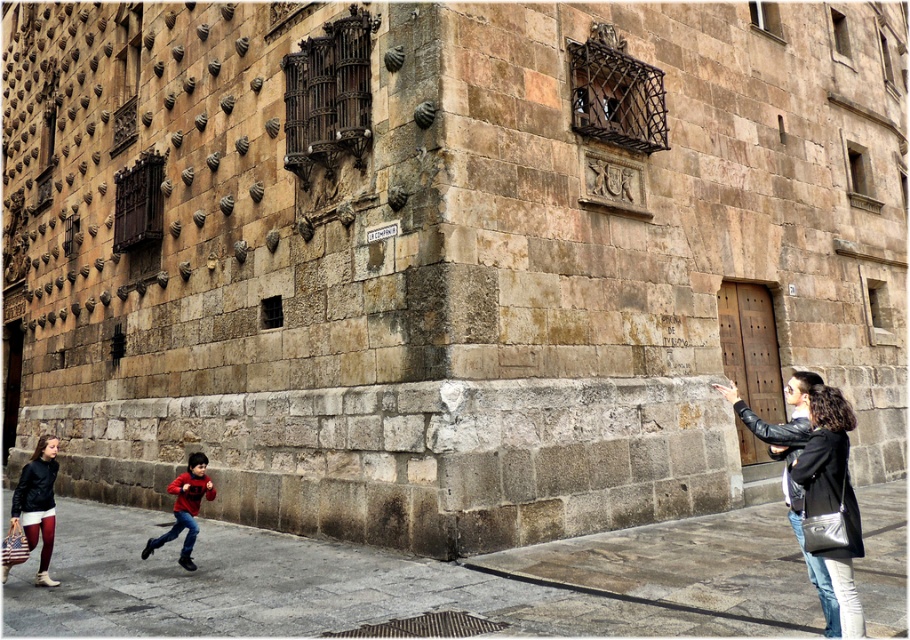
Question: Which point is farther to the camera?

Choices:
 (A) leather jacket at lower right
 (B) matte black jacket at lower left
 (C) matte red sweater at lower left

Answer: (B)

Question: Considering the real-world distances, which object is closest to the matte red sweater at lower left?

Choices:
 (A) matte black jacket at lower left
 (B) leather jacket at lower right

Answer: (A)

Question: Which point is farther from the camera taking this photo?

Choices:
 (A) (184, 522)
 (B) (51, 483)
 (C) (832, 557)

Answer: (A)

Question: From the image, what is the correct spatial relationship of matte black jacket at lower left in relation to matte red sweater at lower left?

Choices:
 (A) below
 (B) above

Answer: (B)

Question: Does matte black jacket at lower left appear on the right side of matte red sweater at lower left?

Choices:
 (A) no
 (B) yes

Answer: (A)

Question: Is leather jacket at lower right above matte black jacket at lower left?

Choices:
 (A) no
 (B) yes

Answer: (B)